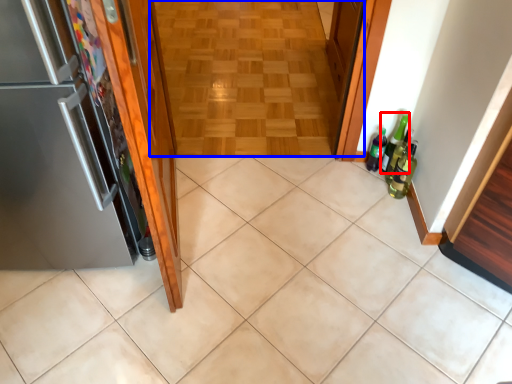
Question: Among these objects, which one is nearest to the camera, beer bottle (highlighted by a red box) or corridor (highlighted by a blue box)?

Choices:
 (A) beer bottle
 (B) corridor

Answer: (A)